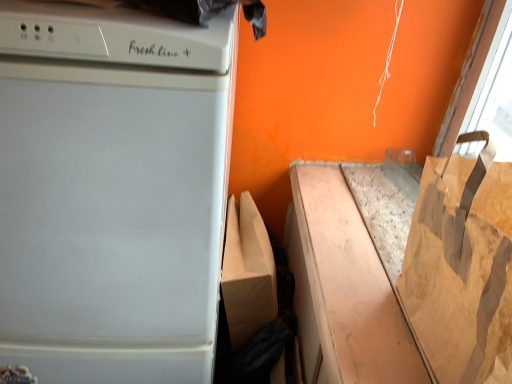
Question: Visually, is brown paper bag at lower right positioned to the left or to the right of brown paper bag at right?

Choices:
 (A) left
 (B) right

Answer: (A)

Question: Is point (329, 372) closer or farther from the camera than point (465, 225)?

Choices:
 (A) closer
 (B) farther

Answer: (B)

Question: Considering the real-world distances, which object is farthest from the brown paper bag at right?

Choices:
 (A) brown paper bag at lower right
 (B) white glossy dishwasher at left

Answer: (B)

Question: Which object is the farthest from the white glossy dishwasher at left?

Choices:
 (A) brown paper bag at lower right
 (B) brown paper bag at right

Answer: (B)